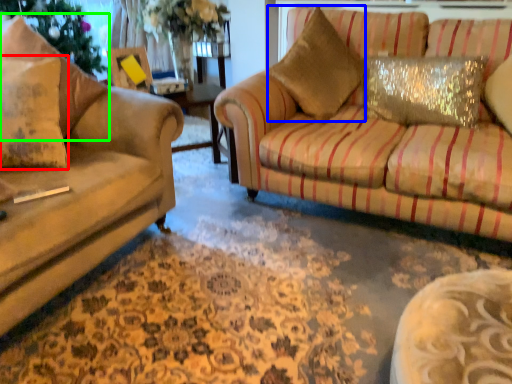
Question: Which object is positioned farthest from pillow (highlighted by a red box)? Select from throw pillow (highlighted by a blue box) and pillow (highlighted by a green box).

Choices:
 (A) throw pillow
 (B) pillow

Answer: (A)